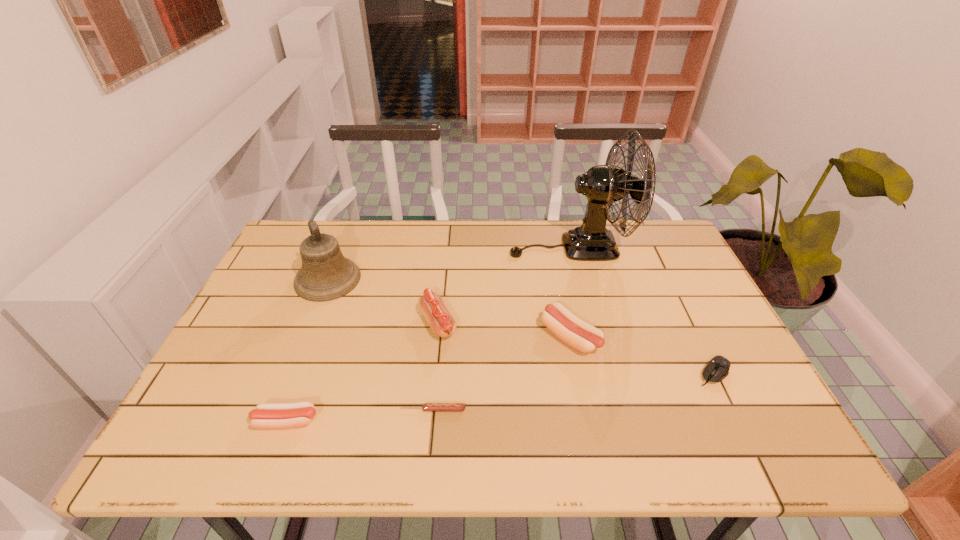
Find the location of a particular element. free space at the far right corner of the desktop is located at coordinates (645, 238).

At what (x,y) coordinates should I click in order to perform the action: click on blank area at the near right corner. Please return your answer as a coordinate pair (x, y). This screenshot has height=540, width=960. Looking at the image, I should click on (755, 421).

The width and height of the screenshot is (960, 540). Find the location of `empty location between the rightmost object and the rightmost sausage`. empty location between the rightmost object and the rightmost sausage is located at coordinates (641, 355).

Locate an element on the screen. Image resolution: width=960 pixels, height=540 pixels. empty location between the rightmost sausage and the second shortest sausage is located at coordinates (428, 379).

Where is `free space between the fan and the leftmost sausage`? free space between the fan and the leftmost sausage is located at coordinates pyautogui.click(x=428, y=334).

Image resolution: width=960 pixels, height=540 pixels. Find the location of `free space between the tallest object and the sixth shortest object`. free space between the tallest object and the sixth shortest object is located at coordinates (449, 263).

What are the coordinates of `empty space that is in between the rightmost sausage and the fan` in the screenshot? It's located at click(x=570, y=292).

At what (x,y) coordinates should I click in order to perform the action: click on the third closest object to the bell. Please return your answer as a coordinate pair (x, y). The height and width of the screenshot is (540, 960). Looking at the image, I should click on (426, 406).

Where is `the sixth closest object to the rightmost sausage`? the sixth closest object to the rightmost sausage is located at coordinates (266, 415).

At what (x,y) coordinates should I click in order to perform the action: click on the fourth closest sausage to the second tallest object. Please return your answer as a coordinate pair (x, y). The height and width of the screenshot is (540, 960). Looking at the image, I should click on (582, 336).